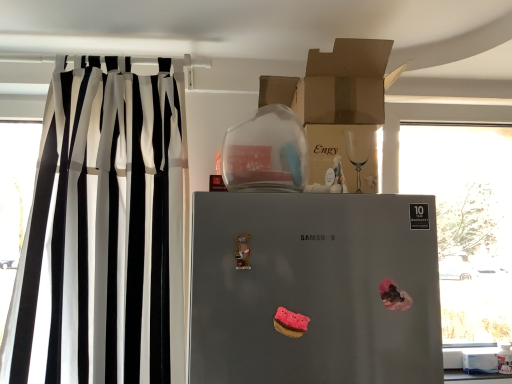
The width and height of the screenshot is (512, 384). In order to click on cardboard box at upper center, arranged as the second cardboard box when ordered from the bottom in this screenshot , I will do `click(335, 84)`.

Identify the location of transparent glass window at right. The width and height of the screenshot is (512, 384). (467, 222).

Describe the element at coordinates (290, 323) in the screenshot. I see `pink matte donut at center, the first stuff from the left` at that location.

This screenshot has height=384, width=512. What are the coordinates of `cardboard box at upper center, which is the 1th cardboard box in top-to-bottom order` in the screenshot? It's located at (335, 84).

Which object is closer to the camera taking this photo, white cardboard box at lower right or transparent glass window at right?

transparent glass window at right is closer to the camera.

What's the angular difference between white cardboard box at lower right and transparent glass window at right's facing directions?

white cardboard box at lower right and transparent glass window at right are facing 1.59 degrees away from each other.

In the image, there is a white cardboard box at lower right. Identify the location of window above it (from the image's perspective). (467, 222).

From the picture: From a real-world perspective, is white cardboard box at lower right beneath transparent glass window at right?

Yes.

Is white cardboard box at lower right smaller than matte brown cardboard box at upper center, which is the 2th cardboard box in top-to-bottom order?

Correct, white cardboard box at lower right occupies less space than matte brown cardboard box at upper center, which is the 2th cardboard box in top-to-bottom order.

From a real-world perspective, is white cardboard box at lower right above or below matte brown cardboard box at upper center, which is the 2th cardboard box in top-to-bottom order?

white cardboard box at lower right is situated lower than matte brown cardboard box at upper center, which is the 2th cardboard box in top-to-bottom order, in the real world.

Considering the positions of objects white cardboard box at lower right and matte brown cardboard box at upper center, which is the 2th cardboard box in top-to-bottom order, in the image provided, who is more to the left, white cardboard box at lower right or matte brown cardboard box at upper center, which is the 2th cardboard box in top-to-bottom order,?

Positioned to the left is matte brown cardboard box at upper center, which is the 2th cardboard box in top-to-bottom order.

Identify the location of box that appears below the matte brown cardboard box at upper center, which is the 2th cardboard box in top-to-bottom order (from a real-world perspective). This screenshot has width=512, height=384. coord(480,360).

Could you tell me if pink felt donut at center, the first stuff positioned from the right, is facing transparent glass jar at upper center?

No, pink felt donut at center, the first stuff positioned from the right, does not turn towards transparent glass jar at upper center.

Could you measure the distance between pink felt donut at center, the first stuff positioned from the right, and transparent glass jar at upper center?

A distance of 20.33 inches exists between pink felt donut at center, the first stuff positioned from the right, and transparent glass jar at upper center.

From the image's perspective, between pink felt donut at center, which is counted as the 1th stuff, starting from the top, and transparent glass jar at upper center, which one is located above?

transparent glass jar at upper center appears higher in the image.

In the scene shown: Between pink felt donut at center, the 1th stuff viewed from the back, and transparent glass jar at upper center, which one has smaller size?

Smaller between the two is pink felt donut at center, the 1th stuff viewed from the back.

Is satin silver refrigerator at center spatially inside cardboard box at upper center, which is the 1th cardboard box in top-to-bottom order, or outside of it?

satin silver refrigerator at center is spatially situated outside cardboard box at upper center, which is the 1th cardboard box in top-to-bottom order.

Is satin silver refrigerator at center thinner than cardboard box at upper center, arranged as the second cardboard box when ordered from the bottom?

No.

From the image's perspective, is satin silver refrigerator at center located above or below cardboard box at upper center, arranged as the second cardboard box when ordered from the bottom?

satin silver refrigerator at center is below cardboard box at upper center, arranged as the second cardboard box when ordered from the bottom.

Which is closer, (302, 292) or (357, 49)?

Point (302, 292).

From a real-world perspective, is matte brown cardboard box at upper center, which is the 2th cardboard box in top-to-bottom order, physically located above or below black/white striped curtain at left?

matte brown cardboard box at upper center, which is the 2th cardboard box in top-to-bottom order, is above black/white striped curtain at left.

Is matte brown cardboard box at upper center, arranged as the 1th cardboard box when ordered from the bottom, positioned beyond the bounds of black/white striped curtain at left?

Yes, matte brown cardboard box at upper center, arranged as the 1th cardboard box when ordered from the bottom, is not within black/white striped curtain at left.

How distant is matte brown cardboard box at upper center, arranged as the 1th cardboard box when ordered from the bottom, from black/white striped curtain at left?

27.25 inches.

Considering the sizes of matte brown cardboard box at upper center, which is the 2th cardboard box in top-to-bottom order, and black/white striped curtain at left in the image, is matte brown cardboard box at upper center, which is the 2th cardboard box in top-to-bottom order, wider or thinner than black/white striped curtain at left?

matte brown cardboard box at upper center, which is the 2th cardboard box in top-to-bottom order, is wider than black/white striped curtain at left.

Can you confirm if black/white striped curtain at left is wider than pink matte donut at center, which is counted as the 2th stuff, starting from the back?

Yes, black/white striped curtain at left is wider than pink matte donut at center, which is counted as the 2th stuff, starting from the back.

Find the location of `the 2nd stuff in front of the black/white striped curtain at left, counting from the anchor's position`. the 2nd stuff in front of the black/white striped curtain at left, counting from the anchor's position is located at coordinates (290, 323).

From a real-world perspective, between black/white striped curtain at left and pink matte donut at center, placed as the 2th stuff when sorted from right to left, who is vertically higher?

In real-world perspective, black/white striped curtain at left is above.

Do you think black/white striped curtain at left is within pink matte donut at center, which ranks as the second stuff in top-to-bottom order, or outside of it?

black/white striped curtain at left is located beyond the bounds of pink matte donut at center, which ranks as the second stuff in top-to-bottom order.

Who is bigger, transparent glass jar at upper center or matte brown cardboard box at upper center, arranged as the 1th cardboard box when ordered from the bottom?

matte brown cardboard box at upper center, arranged as the 1th cardboard box when ordered from the bottom, is bigger.

In terms of height, does transparent glass jar at upper center look taller or shorter compared to matte brown cardboard box at upper center, which is the 2th cardboard box in top-to-bottom order?

In the image, transparent glass jar at upper center appears to be taller than matte brown cardboard box at upper center, which is the 2th cardboard box in top-to-bottom order.

Is transparent glass jar at upper center with matte brown cardboard box at upper center, arranged as the 1th cardboard box when ordered from the bottom?

No, transparent glass jar at upper center is not beside matte brown cardboard box at upper center, arranged as the 1th cardboard box when ordered from the bottom.

Which object is positioned more to the left, transparent glass jar at upper center or matte brown cardboard box at upper center, which is the 2th cardboard box in top-to-bottom order?

transparent glass jar at upper center is more to the left.

The image size is (512, 384). What are the coordinates of `window above the white cardboard box at lower right (from a real-world perspective)` in the screenshot? It's located at (467, 222).

Starting from the white cardboard box at lower right, which cardboard box is the 2nd one to the left? Please provide its 2D coordinates.

[(342, 158)]

Looking at the image, which one is located closer to pink felt donut at center, which appears as the 2th stuff when ordered from the bottom, black/white striped curtain at left or pink matte donut at center, marked as the first stuff in a bottom-to-top arrangement?

pink matte donut at center, marked as the first stuff in a bottom-to-top arrangement, is closer to pink felt donut at center, which appears as the 2th stuff when ordered from the bottom.

Estimate the real-world distances between objects in this image. Which object is closer to white cardboard box at lower right, black/white striped curtain at left or transparent glass window at right?

transparent glass window at right is closer to white cardboard box at lower right.

Based on the photo, looking at the image, which one is located further to pink matte donut at center, marked as the first stuff in a bottom-to-top arrangement, satin silver refrigerator at center or transparent glass jar at upper center?

Based on the image, transparent glass jar at upper center appears to be further to pink matte donut at center, marked as the first stuff in a bottom-to-top arrangement.

Looking at the image, which one is located closer to satin silver refrigerator at center, transparent glass window at right or transparent glass jar at upper center?

transparent glass jar at upper center is positioned closer to the anchor satin silver refrigerator at center.

Based on their spatial positions, is satin silver refrigerator at center or transparent glass window at right further from pink matte donut at center, positioned as the first stuff in front-to-back order?

The object further to pink matte donut at center, positioned as the first stuff in front-to-back order, is transparent glass window at right.

Estimate the real-world distances between objects in this image. Which object is further from satin silver refrigerator at center, pink felt donut at center, which appears as the 2th stuff when ordered from the bottom, or matte brown cardboard box at upper center, arranged as the 1th cardboard box when ordered from the bottom?

The object further to satin silver refrigerator at center is matte brown cardboard box at upper center, arranged as the 1th cardboard box when ordered from the bottom.

Consider the image. Which object lies nearer to the anchor point cardboard box at upper center, arranged as the second cardboard box when ordered from the bottom, pink matte donut at center, which ranks as the second stuff in top-to-bottom order, or transparent glass window at right?

Among the two, transparent glass window at right is located nearer to cardboard box at upper center, arranged as the second cardboard box when ordered from the bottom.

Consider the image. Based on their spatial positions, is pink felt donut at center, the second stuff when ordered from left to right, or cardboard box at upper center, arranged as the second cardboard box when ordered from the bottom, closer to black/white striped curtain at left?

Among the two, cardboard box at upper center, arranged as the second cardboard box when ordered from the bottom, is located nearer to black/white striped curtain at left.

The width and height of the screenshot is (512, 384). Find the location of `stuff between cardboard box at upper center, arranged as the second cardboard box when ordered from the bottom, and pink matte donut at center, placed as the 2th stuff when sorted from right to left, in the vertical direction`. stuff between cardboard box at upper center, arranged as the second cardboard box when ordered from the bottom, and pink matte donut at center, placed as the 2th stuff when sorted from right to left, in the vertical direction is located at coordinates (394, 296).

The image size is (512, 384). In order to click on appliance between black/white striped curtain at left and satin silver refrigerator at center in this screenshot , I will do `click(266, 153)`.

Where is `appliance between cardboard box at upper center, which is the 1th cardboard box in top-to-bottom order, and matte brown cardboard box at upper center, arranged as the 1th cardboard box when ordered from the bottom, in the vertical direction`? This screenshot has height=384, width=512. appliance between cardboard box at upper center, which is the 1th cardboard box in top-to-bottom order, and matte brown cardboard box at upper center, arranged as the 1th cardboard box when ordered from the bottom, in the vertical direction is located at coordinates (266, 153).

At what (x,y) coordinates should I click in order to perform the action: click on window between satin silver refrigerator at center and white cardboard box at lower right along the z-axis. Please return your answer as a coordinate pair (x, y). The image size is (512, 384). Looking at the image, I should click on (467, 222).